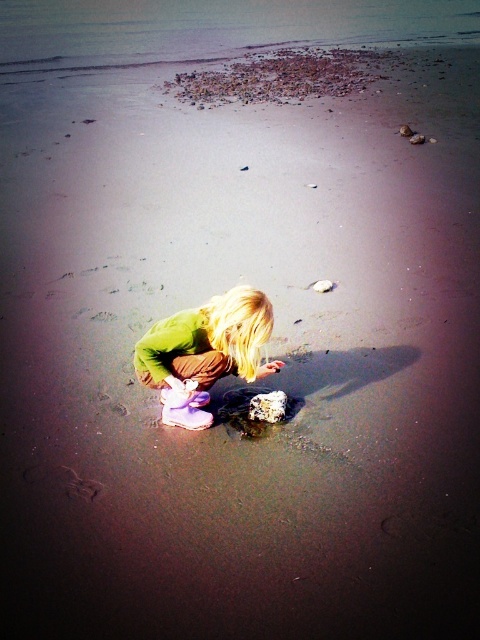
Question: Does green fabric shirt at center appear on the right side of smooth gray rock at lower center?

Choices:
 (A) no
 (B) yes

Answer: (A)

Question: Can you confirm if green fabric shirt at center is thinner than smooth gray rock at lower center?

Choices:
 (A) no
 (B) yes

Answer: (A)

Question: Which of the following is the farthest from the observer?

Choices:
 (A) green fabric shirt at center
 (B) smooth gray rock at lower center

Answer: (B)

Question: Is green fabric shirt at center above smooth gray rock at lower center?

Choices:
 (A) yes
 (B) no

Answer: (A)

Question: Which point is closer to the camera?

Choices:
 (A) (262, 404)
 (B) (217, 310)

Answer: (B)